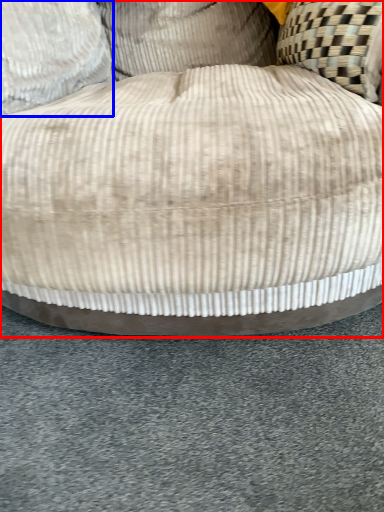
Question: Which object appears closest to the camera in this image, furniture (highlighted by a red box) or pillow (highlighted by a blue box)?

Choices:
 (A) furniture
 (B) pillow

Answer: (A)